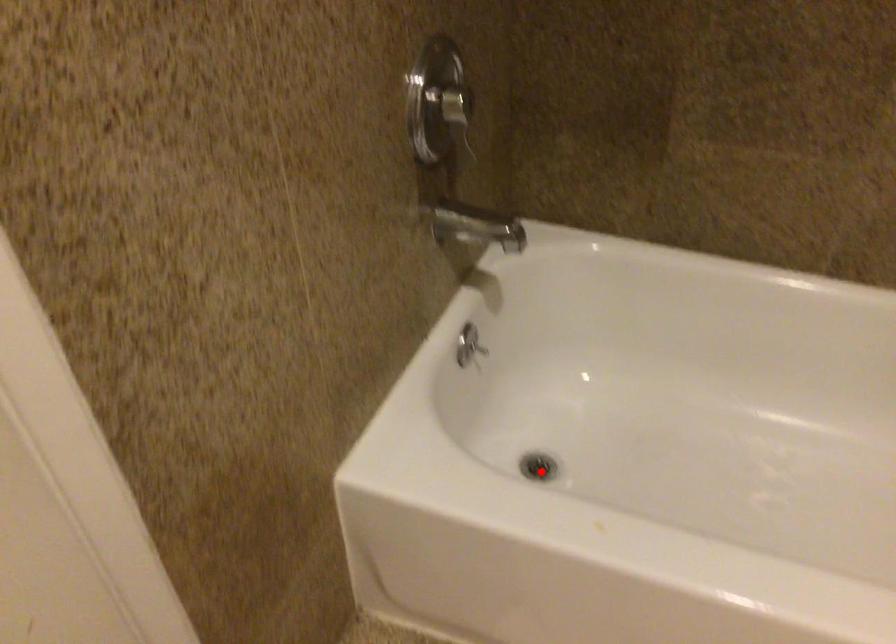
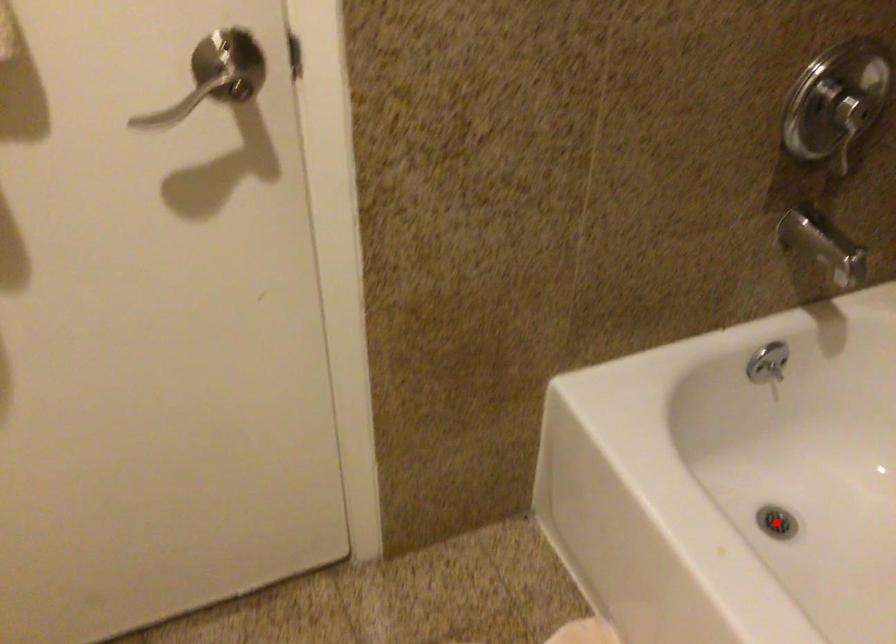
I am providing you with two images of the same scene from different viewpoints. A red point is marked on the first image and another point is marked on the second image. Do the highlighted points in image1 and image2 indicate the same real-world spot?

Yes